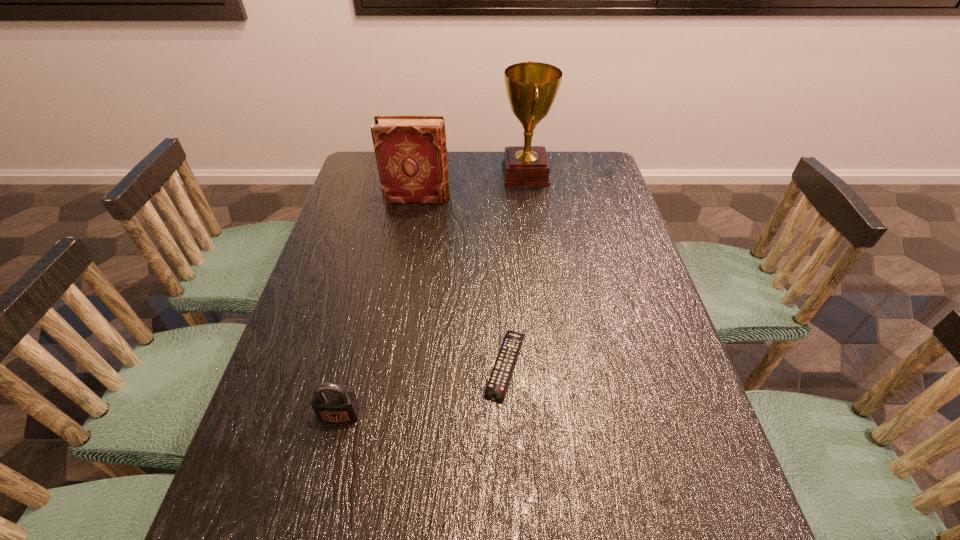
At what (x,y) coordinates should I click in order to perform the action: click on the tallest object. Please return your answer as a coordinate pair (x, y). The width and height of the screenshot is (960, 540). Looking at the image, I should click on (532, 87).

Identify the location of the second tallest object. The image size is (960, 540). (411, 154).

I want to click on the third tallest object, so click(331, 403).

At what (x,y) coordinates should I click in order to perform the action: click on padlock. Please return your answer as a coordinate pair (x, y). Looking at the image, I should click on (331, 403).

This screenshot has width=960, height=540. I want to click on remote control, so click(x=501, y=373).

I want to click on the third farthest object, so click(501, 373).

Locate an element on the screen. This screenshot has width=960, height=540. vacant space located 0.250m on the plaque of the tallest object is located at coordinates (429, 173).

This screenshot has width=960, height=540. Find the location of `vacant space located 0.220m on the plaque of the tallest object`. vacant space located 0.220m on the plaque of the tallest object is located at coordinates (438, 173).

This screenshot has width=960, height=540. Find the location of `free region located on the plaque of the tallest object`. free region located on the plaque of the tallest object is located at coordinates (418, 173).

Identify the location of free space located 0.200m on the spine side of the second tallest object. (512, 198).